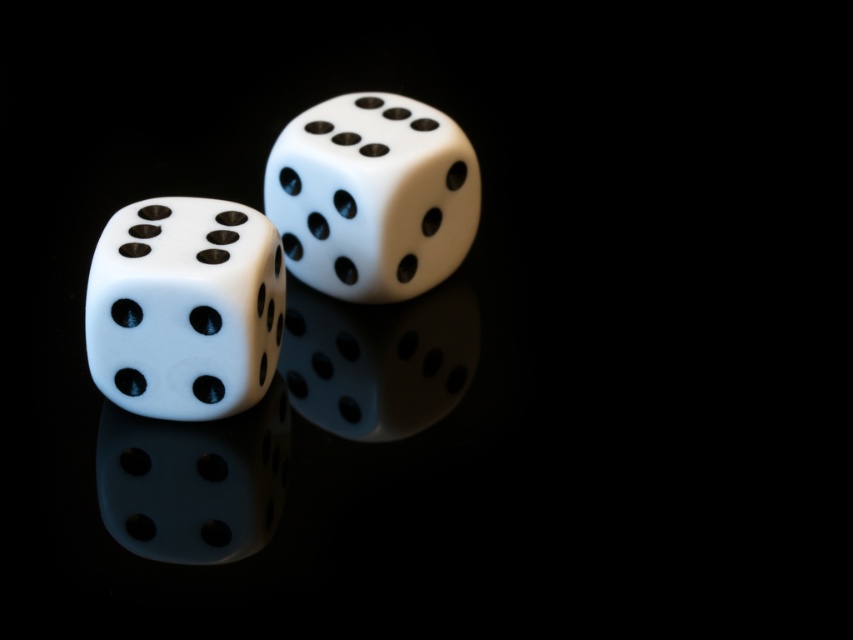
Question: Which object appears farthest from the camera in this image?

Choices:
 (A) matte white dice at center
 (B) matte white dice at left

Answer: (A)

Question: Is matte white dice at left above matte white dice at center?

Choices:
 (A) yes
 (B) no

Answer: (B)

Question: Among these objects, which one is nearest to the camera?

Choices:
 (A) matte white dice at left
 (B) matte white dice at center

Answer: (A)

Question: Is matte white dice at left below matte white dice at center?

Choices:
 (A) yes
 (B) no

Answer: (A)

Question: From the image, what is the correct spatial relationship of matte white dice at left in relation to matte white dice at center?

Choices:
 (A) right
 (B) left

Answer: (B)